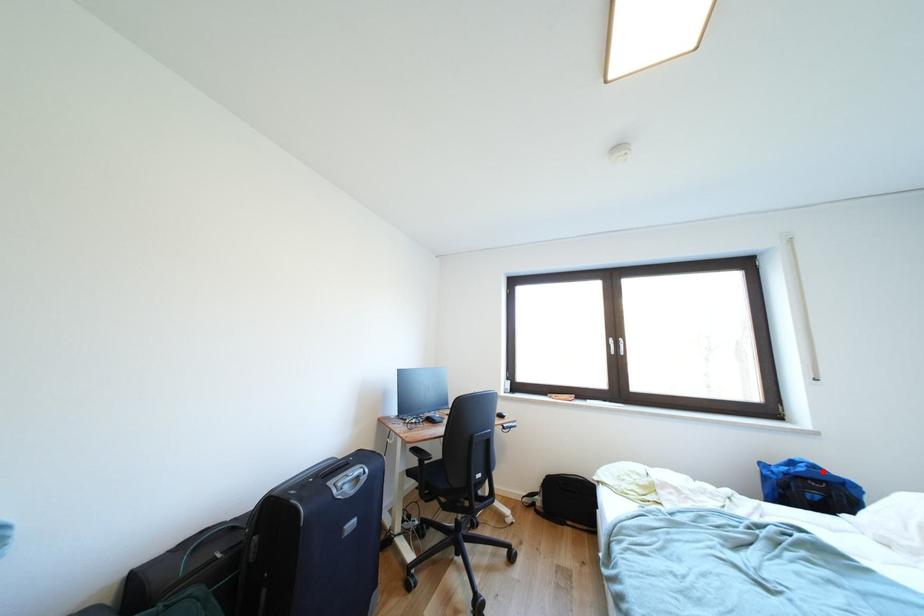
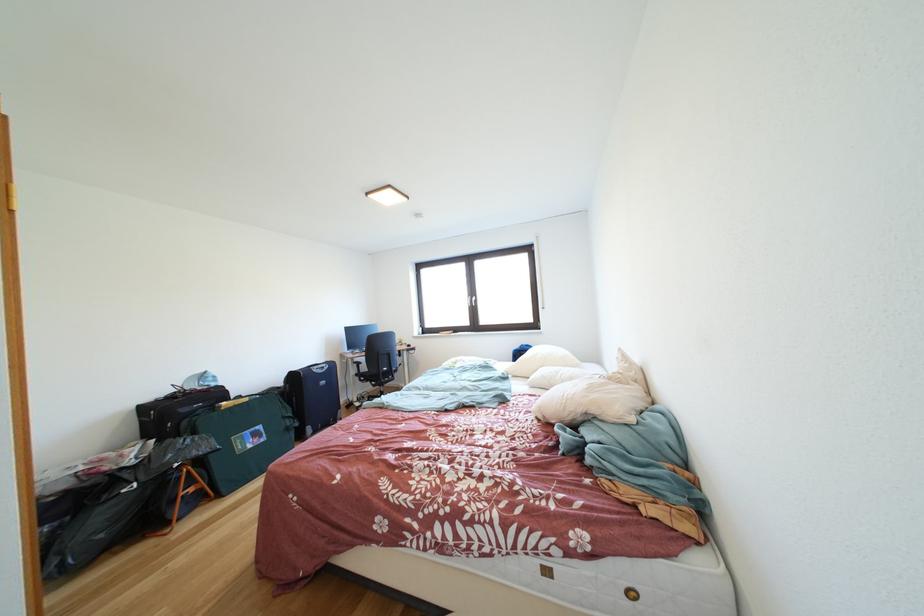
Find the pixel in the second image that matches the highlighted location in the first image.

(535, 351)